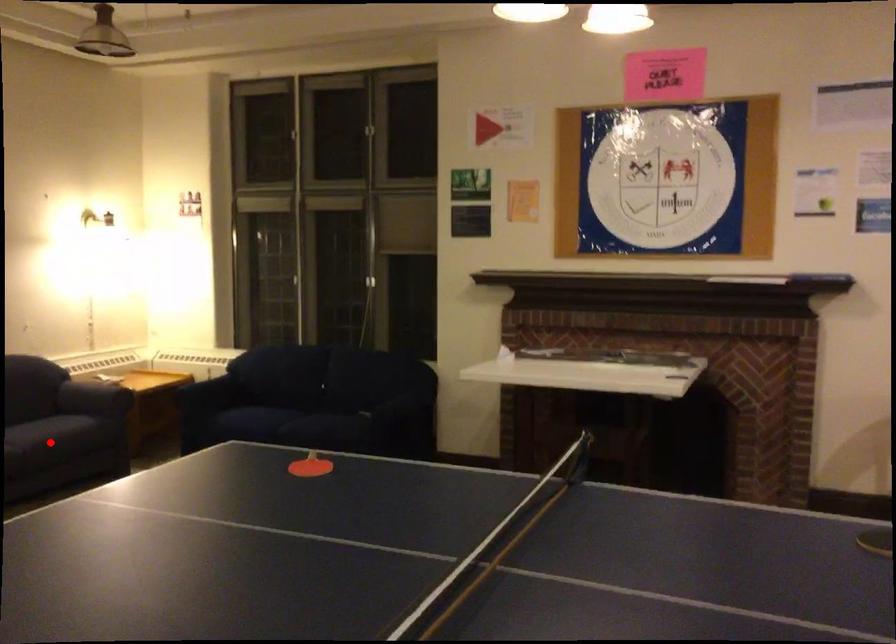
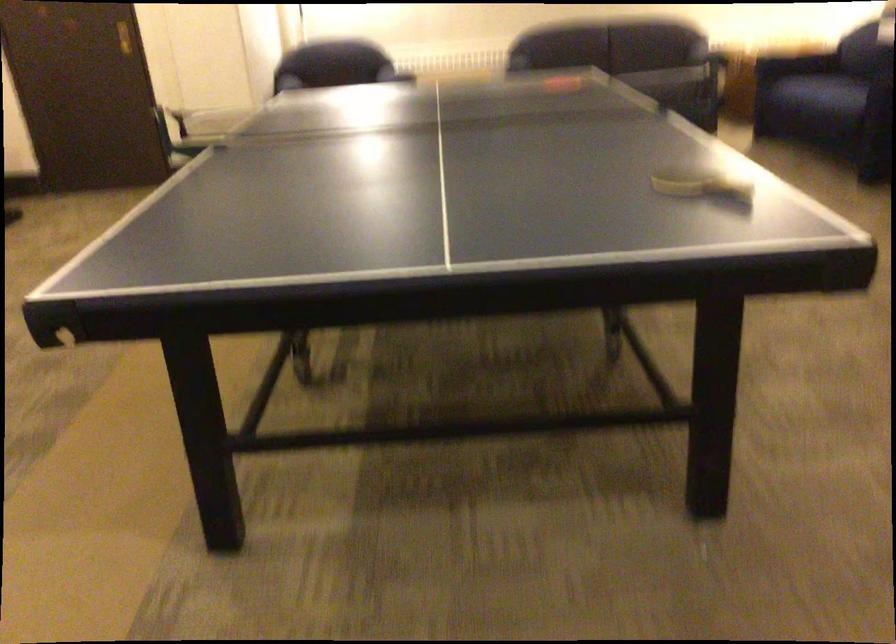
Question: I am providing you with two images of the same scene from different viewpoints. A red point is marked on the first image. At the location where the point appears in image 1, is it still visible in image 2?

Choices:
 (A) Yes
 (B) No

Answer: (B)